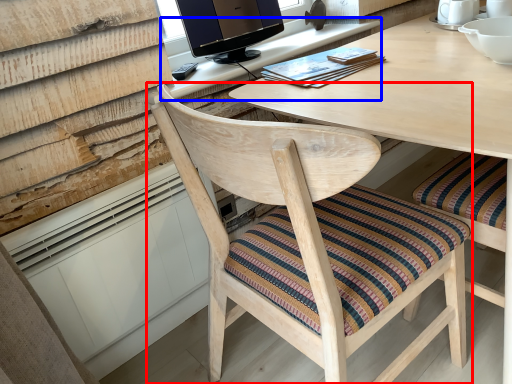
Question: Among these objects, which one is nearest to the camera, chair (highlighted by a red box) or computer desk (highlighted by a blue box)?

Choices:
 (A) chair
 (B) computer desk

Answer: (A)